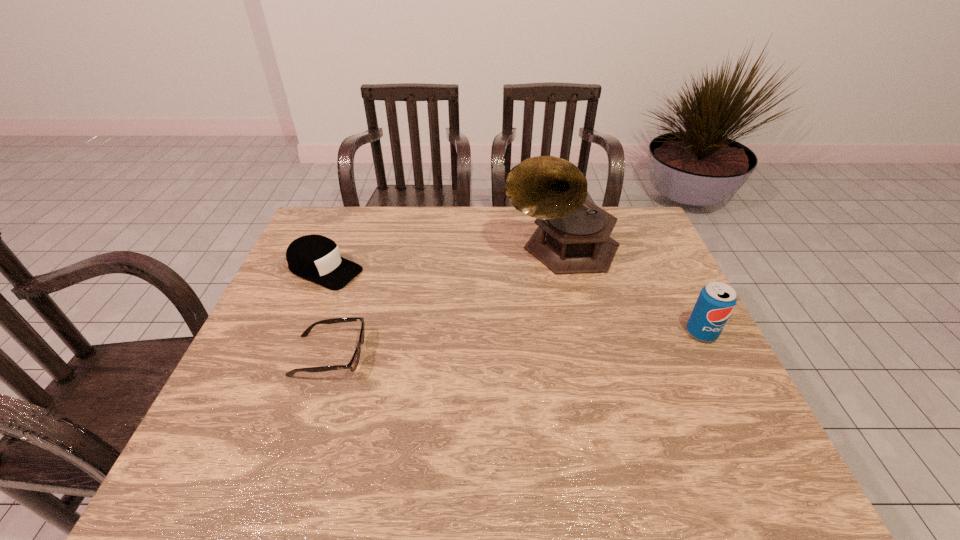
The image size is (960, 540). I want to click on vacant space located 0.130m on the horn direction of the second object from right to left, so click(522, 303).

The height and width of the screenshot is (540, 960). Identify the location of free spot located on the front-facing side of the second shortest object. (372, 286).

In order to click on free space located on the front-facing side of the second shortest object in this screenshot , I will do `click(422, 307)`.

This screenshot has width=960, height=540. Identify the location of vacant space located 0.070m on the front-facing side of the second shortest object. (373, 287).

Where is `object present at the far edge`? object present at the far edge is located at coordinates (573, 236).

This screenshot has width=960, height=540. I want to click on spectacles located in the left edge section of the desktop, so click(x=352, y=365).

Image resolution: width=960 pixels, height=540 pixels. What are the coordinates of `cap that is at the left edge` in the screenshot? It's located at (316, 258).

Locate an element on the screen. This screenshot has height=540, width=960. soda can situated at the right edge is located at coordinates click(716, 301).

What are the coordinates of `phonograph record that is at the right edge` in the screenshot? It's located at (573, 236).

Identify the location of object that is at the far right corner. The width and height of the screenshot is (960, 540). (573, 236).